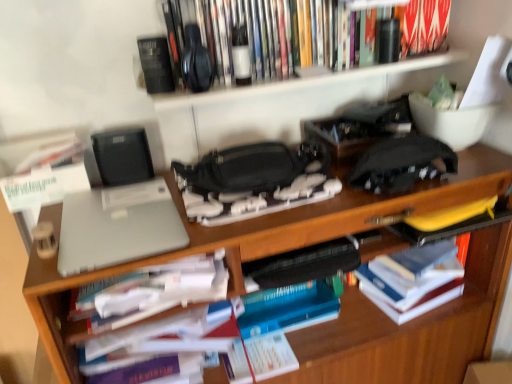
You are a GUI agent. You are given a task and a screenshot of the screen. Output one action in this format:
    pyautogui.click(x=<x>, y=<y>)
    Task: Click on the vacant space situated above sleek silver laptop at left (from a real-world perspective)
    The height and width of the screenshot is (384, 512).
    Given the screenshot: What is the action you would take?
    pyautogui.click(x=143, y=220)